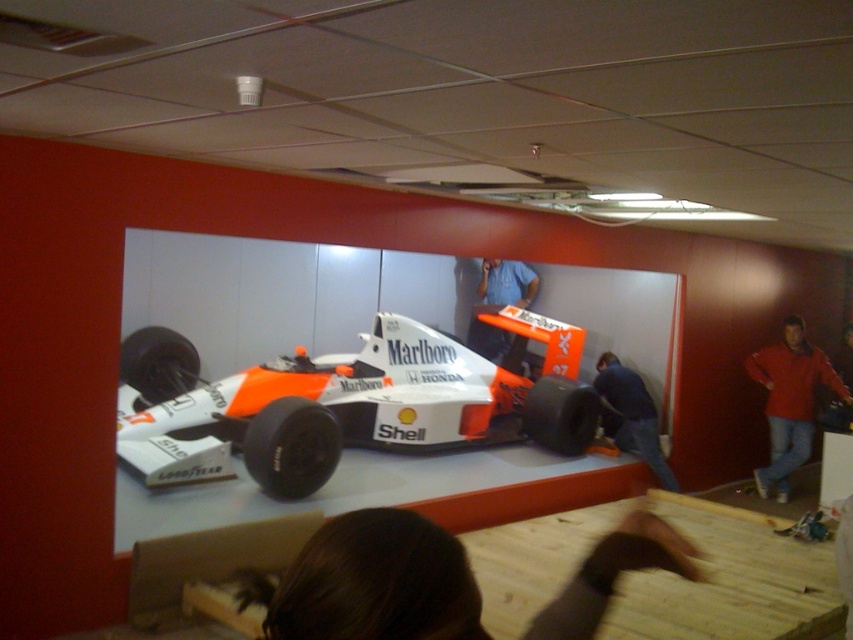
You are a photographer positioned in front of the white matte race car at center and the blue fabric shirt at center. You want to capture a photo where the race car is in focus while the shirt is slightly blurred. Which object should be closer to the camera to achieve this effect?

The white matte race car at center is closer to the viewer than the blue fabric shirt at center. To achieve a focused race car with a blurred shirt, the photographer should ensure the white matte race car at center is positioned closer to the camera, as it already is, creating a depth of field effect where the closer subject is sharp and the farther one is out of focus.

You are standing in front of the Formula One car model and see two people. The first person is at point (171,413). The second person is at point 0.435, 0.671. How far apart are the two people in feet?

The two people are 17.08 feet apart.